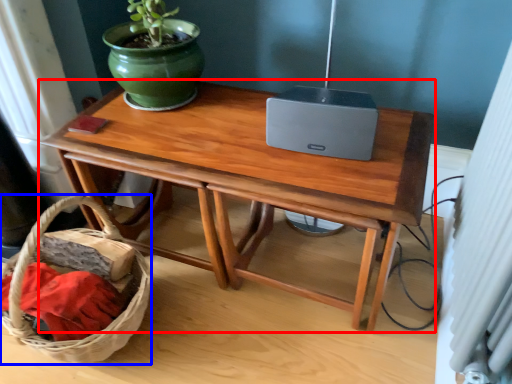
Question: Which point is further to the camera, table (highlighted by a red box) or basket (highlighted by a blue box)?

Choices:
 (A) table
 (B) basket

Answer: (A)